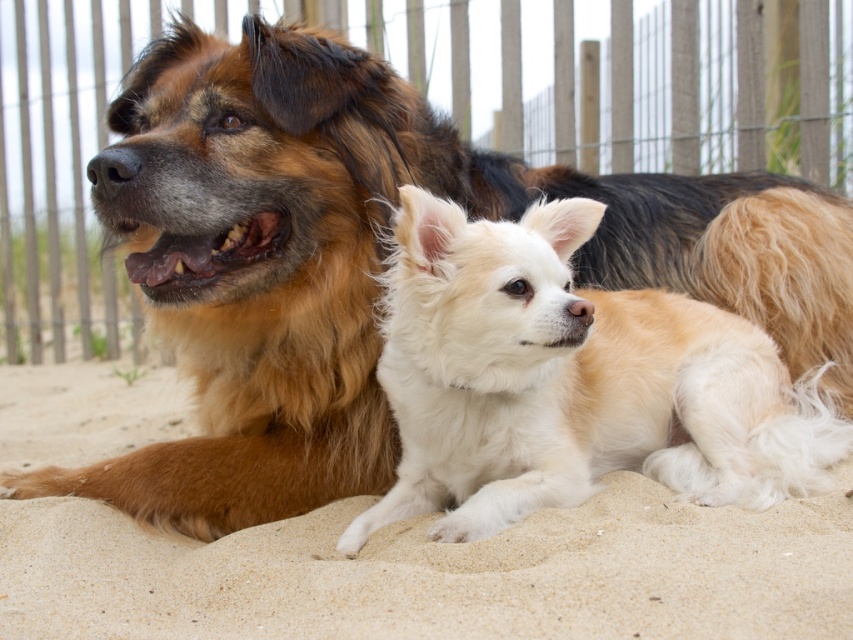
Question: Is fine-grained sand at lower center closer to the viewer compared to fluffy white dog at center?

Choices:
 (A) no
 (B) yes

Answer: (B)

Question: Among these points, which one is nearest to the camera?

Choices:
 (A) (671, 10)
 (B) (572, 289)

Answer: (B)

Question: Is fine-grained sand at lower center positioned at the back of wooden fence at upper center?

Choices:
 (A) yes
 (B) no

Answer: (B)

Question: Considering the relative positions of fine-grained sand at lower center and fluffy white dog at center in the image provided, where is fine-grained sand at lower center located with respect to fluffy white dog at center?

Choices:
 (A) below
 (B) above

Answer: (A)

Question: Which is nearer to the fine-grained sand at lower center?

Choices:
 (A) wooden fence at upper center
 (B) fluffy white dog at center

Answer: (B)

Question: Which point appears farthest from the camera in this image?

Choices:
 (A) (456, 67)
 (B) (474, 230)
 (C) (708, 604)

Answer: (A)